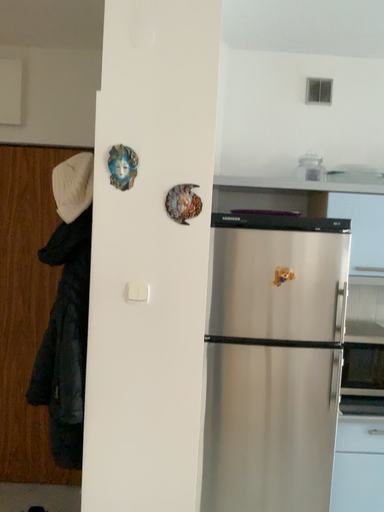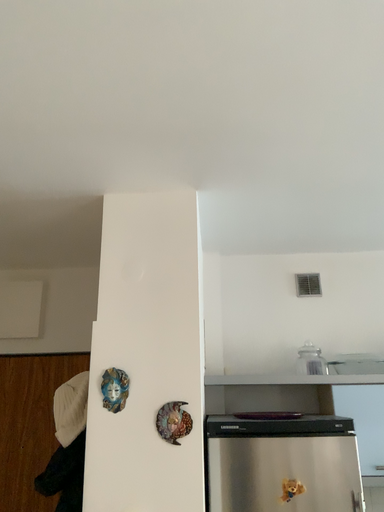
Question: Which way did the camera rotate in the video?

Choices:
 (A) rotated upward
 (B) rotated downward

Answer: (A)